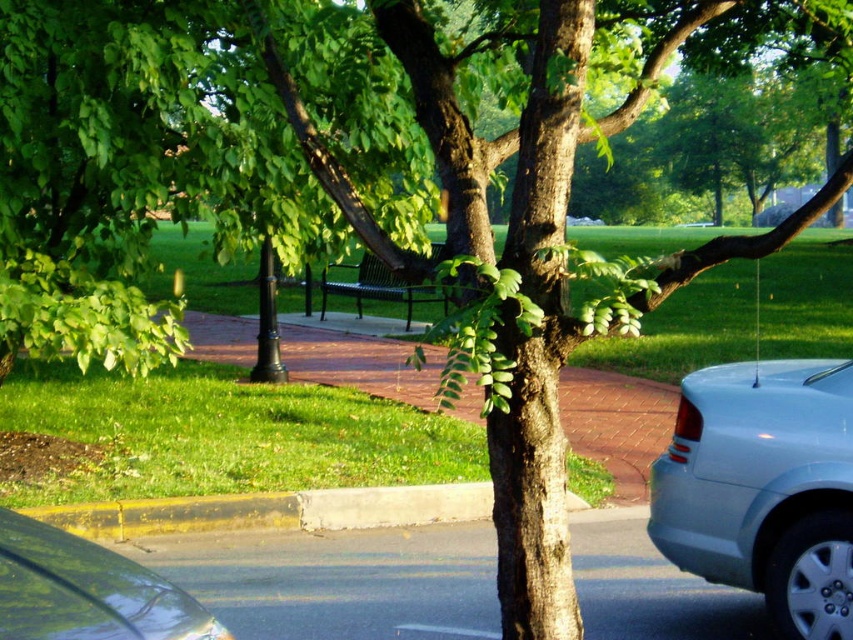
Is clear glass windshield at lower left thinner than yellow asphalt curb at lower center?

Yes, clear glass windshield at lower left is thinner than yellow asphalt curb at lower center.

Does clear glass windshield at lower left appear on the right side of yellow asphalt curb at lower center?

Correct, you'll find clear glass windshield at lower left to the right of yellow asphalt curb at lower center.

This screenshot has width=853, height=640. I want to click on clear glass windshield at lower left, so click(x=86, y=589).

At what (x,y) coordinates should I click in order to perform the action: click on clear glass windshield at lower left. Please return your answer as a coordinate pair (x, y). The image size is (853, 640). Looking at the image, I should click on (86, 589).

Is satin silver sedan at lower right below yellow asphalt curb at lower center?

No, satin silver sedan at lower right is not below yellow asphalt curb at lower center.

Does satin silver sedan at lower right have a smaller size compared to yellow asphalt curb at lower center?

Incorrect, satin silver sedan at lower right is not smaller in size than yellow asphalt curb at lower center.

Which is in front, point (683, 524) or point (270, 502)?

Point (683, 524)

At what (x,y) coordinates should I click in order to perform the action: click on satin silver sedan at lower right. Please return your answer as a coordinate pair (x, y). The image size is (853, 640). Looking at the image, I should click on (763, 488).

Does point (775, 525) come farther from viewer compared to point (54, 624)?

Yes.

Is satin silver sedan at lower right further to camera compared to clear glass windshield at lower left?

Yes.

Between point (712, 449) and point (15, 628), which one is positioned behind?

Point (712, 449)

The width and height of the screenshot is (853, 640). In order to click on satin silver sedan at lower right in this screenshot , I will do `click(763, 488)`.